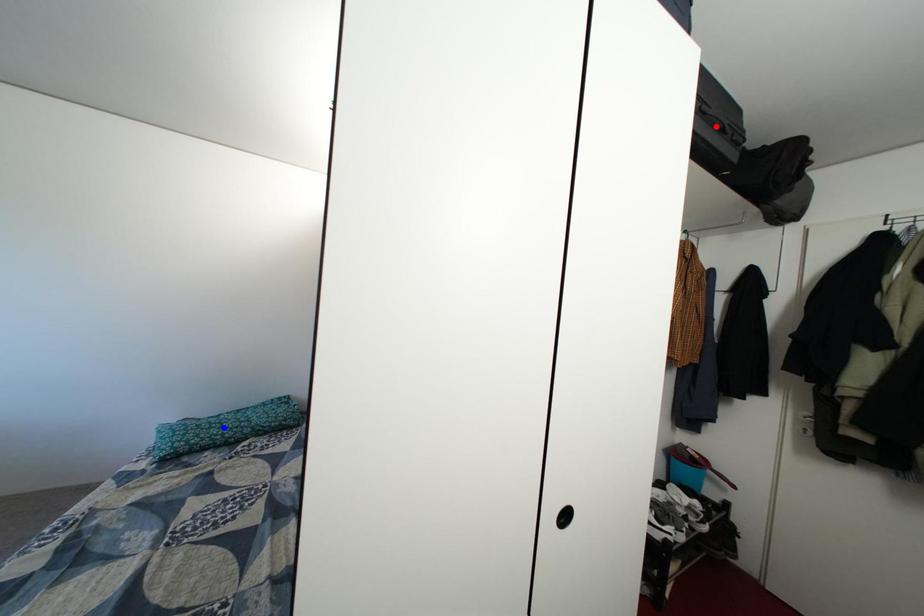
Question: Which of the two points in the image is closer to the camera?

Choices:
 (A) Blue point is closer.
 (B) Red point is closer.

Answer: (B)